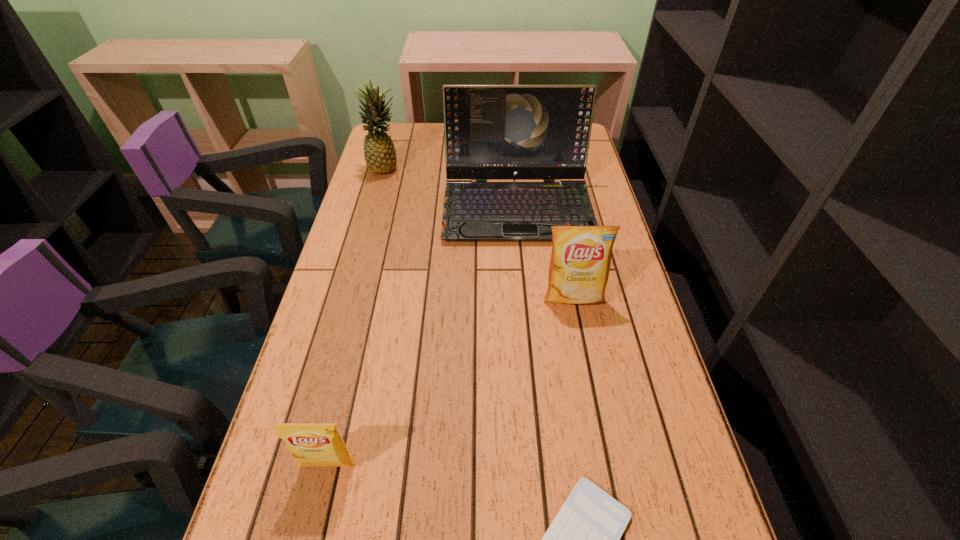
Where is `empty space that is in between the nearer crisp (potato chip) and the pineapple`? empty space that is in between the nearer crisp (potato chip) and the pineapple is located at coordinates coord(357,316).

Identify the location of free spot between the shorter crisp (potato chip) and the taller crisp (potato chip). The height and width of the screenshot is (540, 960). (451, 381).

Where is `free space between the fourth farthest object and the laptop computer`? free space between the fourth farthest object and the laptop computer is located at coordinates (423, 336).

At what (x,y) coordinates should I click in order to perform the action: click on free space between the left crisp (potato chip) and the laptop computer. Please return your answer as a coordinate pair (x, y). This screenshot has height=540, width=960. Looking at the image, I should click on (423, 336).

I want to click on free area in between the laptop computer and the third farthest object, so click(x=545, y=252).

Identify the location of object that is the third closest to the calculator. (492, 132).

Identify which object is the fourth nearest to the nearest object. Please provide its 2D coordinates. Your answer should be formatted as a tuple, i.e. [(x, y)], where the tuple contains the x and y coordinates of a point satisfying the conditions above.

[(380, 156)]